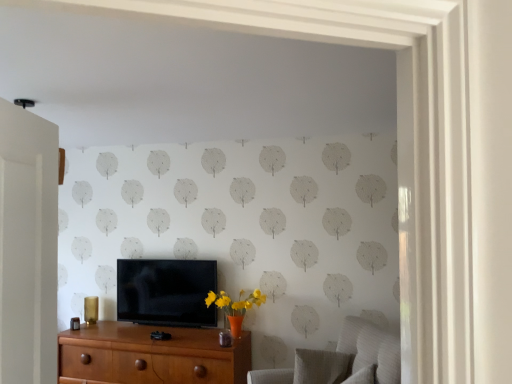
Question: Is textured gray swivel chair at lower right, the first swivel chair viewed from the front, not near textured gray swivel chair at lower right, which ranks as the 2th swivel chair in front-to-back order?

Choices:
 (A) yes
 (B) no

Answer: (B)

Question: From the image's perspective, is textured gray swivel chair at lower right, marked as the second swivel chair in a back-to-front arrangement, over textured gray swivel chair at lower right, which ranks as the 2th swivel chair in front-to-back order?

Choices:
 (A) no
 (B) yes

Answer: (B)

Question: Considering the relative positions of textured gray swivel chair at lower right, the first swivel chair viewed from the front, and textured gray swivel chair at lower right, which ranks as the 2th swivel chair in front-to-back order, in the image provided, is textured gray swivel chair at lower right, the first swivel chair viewed from the front, in front of textured gray swivel chair at lower right, which ranks as the 2th swivel chair in front-to-back order,?

Choices:
 (A) no
 (B) yes

Answer: (B)

Question: From a real-world perspective, is textured gray swivel chair at lower right, marked as the second swivel chair in a back-to-front arrangement, located beneath textured gray swivel chair at lower right, the 1th swivel chair when ordered from back to front?

Choices:
 (A) yes
 (B) no

Answer: (B)

Question: Is textured gray swivel chair at lower right, the first swivel chair viewed from the front, facing towards textured gray swivel chair at lower right, the 1th swivel chair when ordered from back to front?

Choices:
 (A) yes
 (B) no

Answer: (A)

Question: Is textured gray swivel chair at lower right, the 1th swivel chair when ordered from back to front, taller or shorter than brown wood chest of drawers at lower center?

Choices:
 (A) tall
 (B) short

Answer: (B)

Question: From the image's perspective, is textured gray swivel chair at lower right, the 1th swivel chair when ordered from back to front, positioned above or below brown wood chest of drawers at lower center?

Choices:
 (A) below
 (B) above

Answer: (B)

Question: Is textured gray swivel chair at lower right, which ranks as the 2th swivel chair in front-to-back order, wider or thinner than brown wood chest of drawers at lower center?

Choices:
 (A) wide
 (B) thin

Answer: (B)

Question: Is point (316, 365) positioned closer to the camera than point (165, 347)?

Choices:
 (A) farther
 (B) closer

Answer: (B)

Question: Looking at the image, does textured gray swivel chair at lower right, the first swivel chair viewed from the front, seem bigger or smaller compared to textured gray swivel chair at lower right, which ranks as the 2th swivel chair in front-to-back order?

Choices:
 (A) small
 (B) big

Answer: (B)

Question: Considering the positions of point (331, 382) and point (320, 354), is point (331, 382) closer or farther from the camera than point (320, 354)?

Choices:
 (A) farther
 (B) closer

Answer: (B)

Question: Relative to textured gray swivel chair at lower right, which ranks as the 2th swivel chair in front-to-back order, is textured gray swivel chair at lower right, marked as the second swivel chair in a back-to-front arrangement, in front or behind?

Choices:
 (A) front
 (B) behind

Answer: (A)

Question: From the image's perspective, is textured gray swivel chair at lower right, marked as the second swivel chair in a back-to-front arrangement, positioned above or below textured gray swivel chair at lower right, which ranks as the 2th swivel chair in front-to-back order?

Choices:
 (A) above
 (B) below

Answer: (A)

Question: Would you say textured gray swivel chair at lower right, which ranks as the 2th swivel chair in front-to-back order, is to the left or to the right of textured gray swivel chair at lower right, marked as the second swivel chair in a back-to-front arrangement, in the picture?

Choices:
 (A) right
 (B) left

Answer: (B)

Question: Is textured gray swivel chair at lower right, the 1th swivel chair when ordered from back to front, wider or thinner than textured gray swivel chair at lower right, marked as the second swivel chair in a back-to-front arrangement?

Choices:
 (A) thin
 (B) wide

Answer: (A)